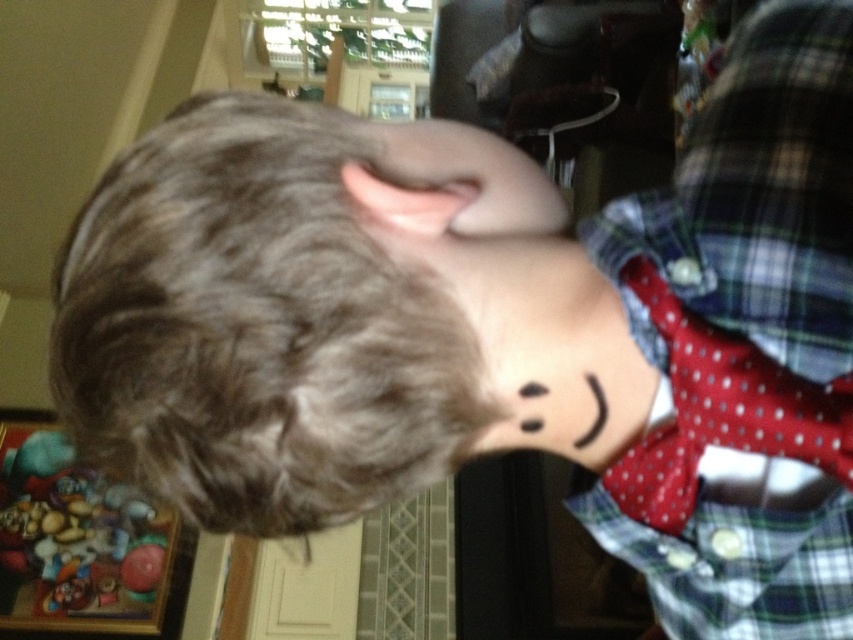
Question: Can you confirm if brown matte hair at center is bigger than plaid fabric shirt at right?

Choices:
 (A) no
 (B) yes

Answer: (A)

Question: Which point appears farthest from the camera in this image?

Choices:
 (A) (523, 353)
 (B) (282, 328)
 (C) (30, 579)
 (D) (743, 236)

Answer: (C)

Question: Which point is farther from the camera taking this photo?

Choices:
 (A) (225, 160)
 (B) (758, 348)

Answer: (B)

Question: Which point appears farthest from the camera in this image?

Choices:
 (A) (165, 561)
 (B) (712, 236)
 (C) (56, 288)
 (D) (486, 272)

Answer: (A)

Question: Is plaid fabric shirt at right below black matte neck at center?

Choices:
 (A) no
 (B) yes

Answer: (A)

Question: Is plaid fabric shirt at right to the right of black matte neck at center from the viewer's perspective?

Choices:
 (A) no
 (B) yes

Answer: (B)